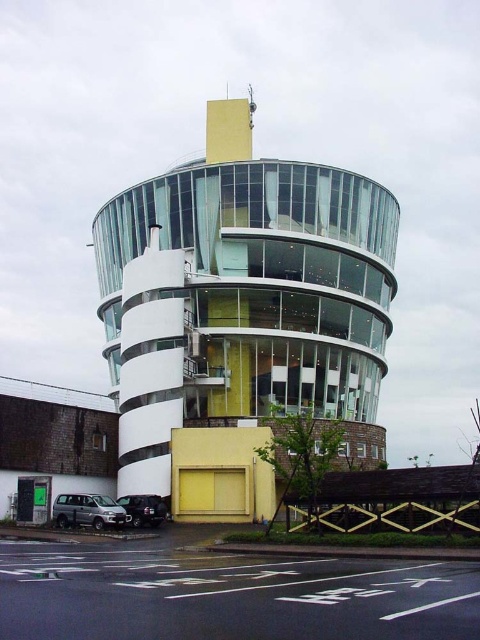
You are a delivery person driving a truck that is 4 meters long. You need to park your truck between the silver metallic van at lower left and the shiny black suv at lower left. Is there enough space between them to park your truck?

The distance between the silver metallic van at lower left and the shiny black suv at lower left is 4.08 meters. Since your truck is 4 meters long, there is enough space to park between them as the available space is slightly larger than the truck.

You are a delivery driver approaching the transparent glass tower at center and the silver metallic van at lower left. Your vehicle is 2 meters wide. Can you safely navigate through the narrow alley between them without hitting either side?

The transparent glass tower at center is wider than the silver metallic van at lower left. Since the alley is narrow, and the tower is wider, it might limit the space available. However, without knowing the exact width of the alley, it is difficult to determine if your vehicle can pass safely. Please check the alley width before proceeding.